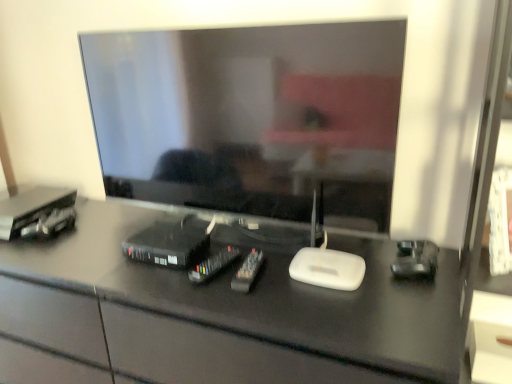
This screenshot has height=384, width=512. I want to click on unoccupied area behind black plastic remote controls at center, the 4th equipment when ordered from left to right, so click(251, 247).